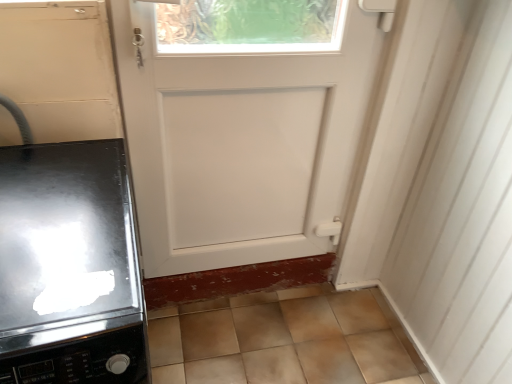
What do you see at coordinates (69, 266) in the screenshot? I see `glossy black stove at left` at bounding box center [69, 266].

Where is `glossy black stove at left`? The width and height of the screenshot is (512, 384). glossy black stove at left is located at coordinates (69, 266).

This screenshot has height=384, width=512. What do you see at coordinates (244, 124) in the screenshot? I see `white matte door at center` at bounding box center [244, 124].

Where is `white matte door at center`? white matte door at center is located at coordinates (244, 124).

I want to click on glossy black stove at left, so point(69,266).

Is white matte door at center at the left side of glossy black stove at left?

In fact, white matte door at center is to the right of glossy black stove at left.

Is the depth of white matte door at center less than that of glossy black stove at left?

No, the depth of white matte door at center is greater than that of glossy black stove at left.

Which is closer, (269, 7) or (86, 264)?

The point (86, 264) is more forward.

From the image's perspective, is white matte door at center below glossy black stove at left?

No, from the image's perspective, white matte door at center is not beneath glossy black stove at left.

From a real-world perspective, is white matte door at center positioned above or below glossy black stove at left?

Clearly, from a real-world perspective, white matte door at center is above glossy black stove at left.

Does white matte door at center have a lesser width compared to glossy black stove at left?

Yes.

Is white matte door at center shorter than glossy black stove at left?

Incorrect, the height of white matte door at center does not fall short of that of glossy black stove at left.

Considering the sizes of objects white matte door at center and glossy black stove at left in the image provided, who is smaller, white matte door at center or glossy black stove at left?

white matte door at center is smaller.

Is glossy black stove at left a part of white matte door at center?

That's incorrect, glossy black stove at left is not inside white matte door at center.

Is white matte door at center far from glossy black stove at left?

Actually, white matte door at center and glossy black stove at left are a little close together.

Is white matte door at center positioned with its back to glossy black stove at left?

That's not correct — white matte door at center is not looking away from glossy black stove at left.

Find the location of a particular element. This screenshot has height=384, width=512. door located behind the glossy black stove at left is located at coordinates (244, 124).

Does glossy black stove at left appear on the left side of white matte door at center?

Indeed, glossy black stove at left is positioned on the left side of white matte door at center.

Is the depth of glossy black stove at left less than that of white matte door at center?

Yes, it is.

Which is in front, point (37, 239) or point (217, 99)?

Point (37, 239)

From the image's perspective, is glossy black stove at left beneath white matte door at center?

Yes.

From a real-world perspective, is glossy black stove at left located beneath white matte door at center?

Correct, in the physical world, glossy black stove at left is lower than white matte door at center.

Considering the sizes of objects glossy black stove at left and white matte door at center in the image provided, who is thinner, glossy black stove at left or white matte door at center?

white matte door at center is thinner.

Between glossy black stove at left and white matte door at center, which one has less height?

glossy black stove at left is shorter.

Considering the relative sizes of glossy black stove at left and white matte door at center in the image provided, is glossy black stove at left smaller than white matte door at center?

Incorrect, glossy black stove at left is not smaller in size than white matte door at center.

Is white matte door at center completely or partially inside glossy black stove at left?

That's incorrect, white matte door at center is not inside glossy black stove at left.

In the scene shown: Is glossy black stove at left beside white matte door at center?

No, glossy black stove at left is not with white matte door at center.

Is glossy black stove at left aimed at white matte door at center?

No, glossy black stove at left is not facing towards white matte door at center.

Identify the location of home appliance directly beneath the white matte door at center (from a real-world perspective). This screenshot has height=384, width=512. (69, 266).

In the image, there is a white matte door at center. Find the location of `home appliance below it (from a real-world perspective)`. home appliance below it (from a real-world perspective) is located at coordinates (69, 266).

This screenshot has width=512, height=384. What are the coordinates of `door behind the glossy black stove at left` in the screenshot? It's located at (244, 124).